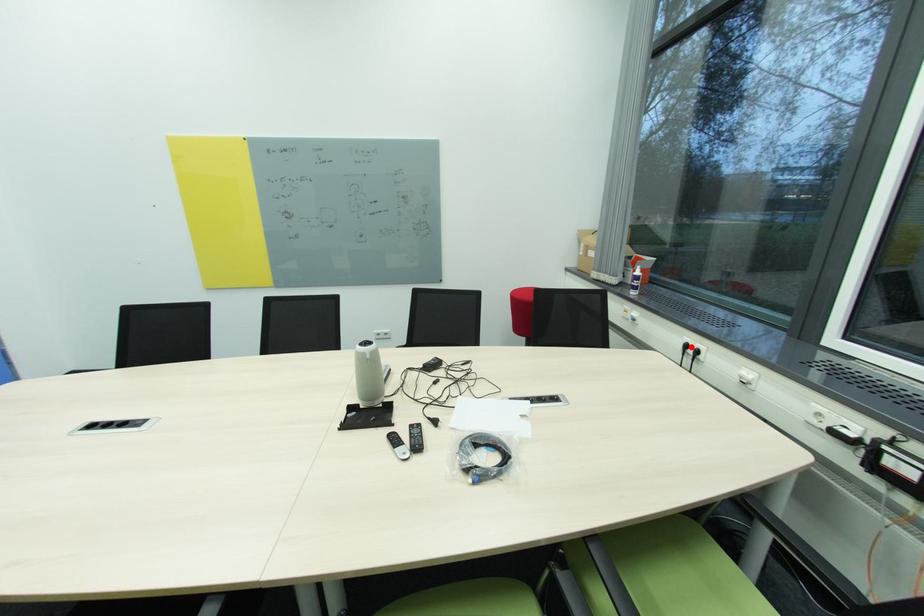
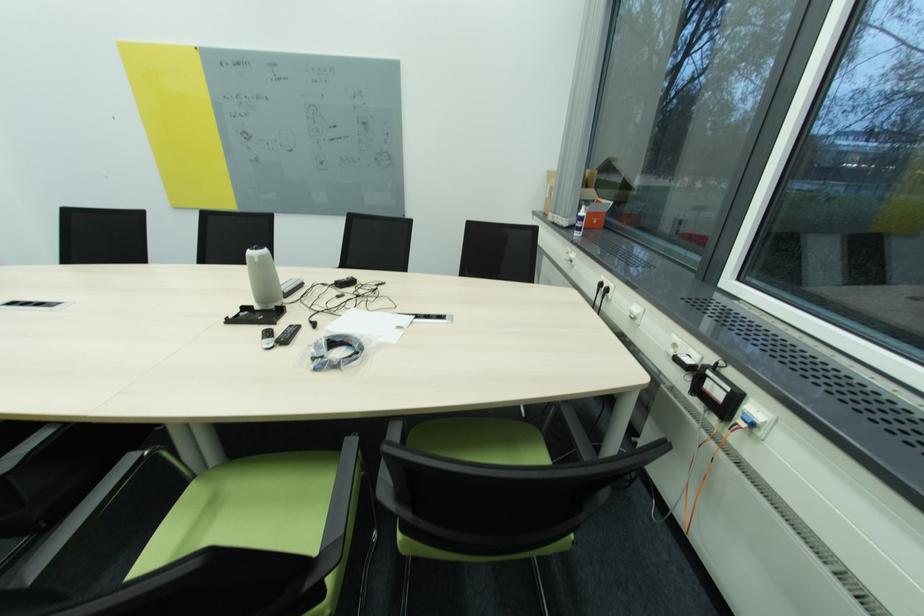
The point at the highlighted location is marked in the first image. Where is the corresponding point in the second image?

(604, 286)